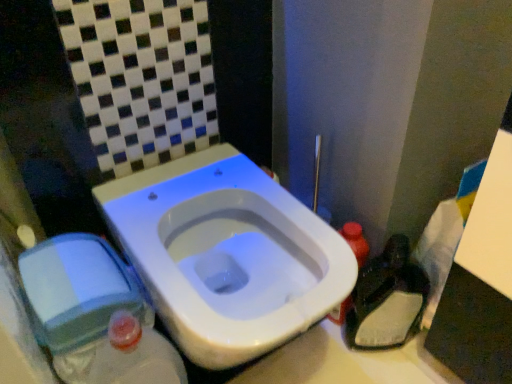
This screenshot has height=384, width=512. I want to click on dark plastic bag at lower right, so click(x=386, y=300).

Describe the element at coordinates (227, 254) in the screenshot. I see `white glossy toilet at center` at that location.

I want to click on dark plastic bag at lower right, so click(x=386, y=300).

Considering their positions, is translucent plastic bottle at right located in front of or behind white glossy toilet at center?

Visually, translucent plastic bottle at right is located behind white glossy toilet at center.

The height and width of the screenshot is (384, 512). Find the location of `toilet on the left of translucent plastic bottle at right`. toilet on the left of translucent plastic bottle at right is located at coordinates click(227, 254).

From a real-world perspective, is translucent plastic bottle at right physically below white glossy toilet at center?

Yes, from a real-world perspective, translucent plastic bottle at right is under white glossy toilet at center.

Which of these two, translucent plastic bottle at right or white glossy toilet at center, is smaller?

Smaller between the two is translucent plastic bottle at right.

Is dark plastic bag at lower right located outside white glossy toilet at center?

Yes, dark plastic bag at lower right is not within white glossy toilet at center.

From a real-world perspective, who is located higher, dark plastic bag at lower right or white glossy toilet at center?

white glossy toilet at center.

In the image, is dark plastic bag at lower right positioned in front of or behind white glossy toilet at center?

Visually, dark plastic bag at lower right is located behind white glossy toilet at center.

Which object is thinner, dark plastic bag at lower right or white glossy toilet at center?

dark plastic bag at lower right.

Between translucent plastic bottle at right and dark plastic bag at lower right, which one is positioned behind?

translucent plastic bottle at right is further away from the camera.

Is translucent plastic bottle at right next to dark plastic bag at lower right and touching it?

Yes, translucent plastic bottle at right is in contact with dark plastic bag at lower right.

From the image's perspective, which one is positioned higher, translucent plastic bottle at right or dark plastic bag at lower right?

translucent plastic bottle at right is shown above in the image.

From the image's perspective, which is below, white glossy toilet at center or dark plastic bag at lower right?

dark plastic bag at lower right.

Looking at this image, is white glossy toilet at center at the left side of dark plastic bag at lower right?

Yes.

How many degrees apart are the facing directions of white glossy toilet at center and dark plastic bag at lower right?

They differ by 34.9 degrees in their facing directions.

Find the location of a particular element. The width and height of the screenshot is (512, 384). garbage on the right of translucent plastic bottle at right is located at coordinates (386, 300).

Is dark plastic bag at lower right touching translucent plastic bottle at right?

Indeed, dark plastic bag at lower right and translucent plastic bottle at right are beside each other and touching.

Considering the points (418, 315) and (352, 240), which point is behind, point (418, 315) or point (352, 240)?

Point (418, 315)

Can you confirm if dark plastic bag at lower right is smaller than translucent plastic bottle at right?

No, dark plastic bag at lower right is not smaller than translucent plastic bottle at right.

Is white glossy toilet at center smaller than translucent plastic bottle at right?

No, white glossy toilet at center is not smaller than translucent plastic bottle at right.

From a real-world perspective, relative to translucent plastic bottle at right, is white glossy toilet at center vertically above or below?

In terms of real-world spatial position, white glossy toilet at center is above translucent plastic bottle at right.

From the picture: Is white glossy toilet at center not within translucent plastic bottle at right?

Indeed, white glossy toilet at center is completely outside translucent plastic bottle at right.

How different are the orientations of white glossy toilet at center and translucent plastic bottle at right in degrees?

They differ by 0.000228 degrees in their facing directions.

Where is `toilet to the left of translucent plastic bottle at right`? toilet to the left of translucent plastic bottle at right is located at coordinates (227, 254).

The image size is (512, 384). I want to click on toilet located above the dark plastic bag at lower right (from the image's perspective), so click(227, 254).

Estimate the real-world distances between objects in this image. Which object is further from white glossy toilet at center, dark plastic bag at lower right or translucent plastic bottle at right?

Based on the image, dark plastic bag at lower right appears to be further to white glossy toilet at center.

Looking at the image, which one is located further to dark plastic bag at lower right, white glossy toilet at center or translucent plastic bottle at right?

white glossy toilet at center lies further to dark plastic bag at lower right than the other object.

When comparing their distances from dark plastic bag at lower right, does translucent plastic bottle at right or white glossy toilet at center seem further?

white glossy toilet at center.

Consider the image. Based on their spatial positions, is translucent plastic bottle at right or dark plastic bag at lower right further from white glossy toilet at center?

dark plastic bag at lower right lies further to white glossy toilet at center than the other object.

Based on their spatial positions, is dark plastic bag at lower right or white glossy toilet at center further from translucent plastic bottle at right?

white glossy toilet at center.

In the scene shown: When comparing their distances from translucent plastic bottle at right, does white glossy toilet at center or dark plastic bag at lower right seem further?

Based on the image, white glossy toilet at center appears to be further to translucent plastic bottle at right.

Image resolution: width=512 pixels, height=384 pixels. Find the location of `bottle between white glossy toilet at center and dark plastic bag at lower right from left to right`. bottle between white glossy toilet at center and dark plastic bag at lower right from left to right is located at coordinates (356, 241).